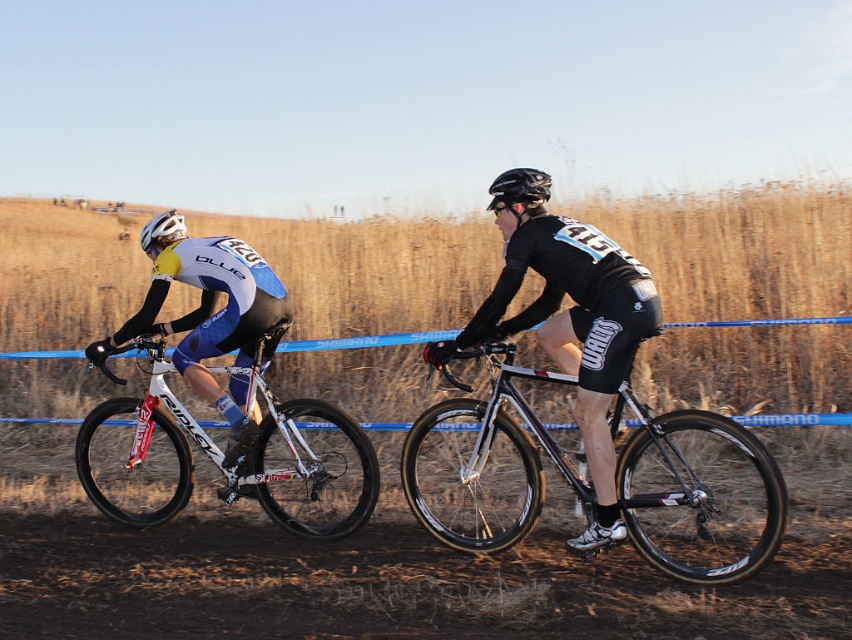
Question: Can you confirm if brown dirt track at lower center is positioned above black glossy bicycle at center?

Choices:
 (A) yes
 (B) no

Answer: (B)

Question: Among these objects, which one is farthest from the camera?

Choices:
 (A) white matte mountain bike at left
 (B) brown dirt track at lower center
 (C) black matte helmet at center

Answer: (A)

Question: Estimate the real-world distances between objects in this image. Which object is farther from the white matte mountain bike at left?

Choices:
 (A) black glossy bicycle at center
 (B) shiny black frame at center
 (C) black matte helmet at center
 (D) white glossy bicycle at left

Answer: (C)

Question: Estimate the real-world distances between objects in this image. Which object is closer to the black glossy bicycle at center?

Choices:
 (A) white glossy bicycle at left
 (B) black matte helmet at center
 (C) white matte mountain bike at left

Answer: (B)

Question: Does shiny black frame at center appear on the left side of white glossy bicycle at left?

Choices:
 (A) no
 (B) yes

Answer: (A)

Question: Does brown dirt track at lower center appear under black matte helmet at center?

Choices:
 (A) yes
 (B) no

Answer: (A)